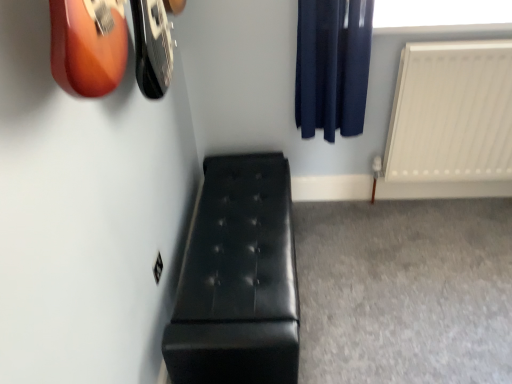
At what (x,y) coordinates should I click in order to perform the action: click on free space that is to the left of white matte radiator at right. Please return your answer as a coordinate pair (x, y). The height and width of the screenshot is (384, 512). Looking at the image, I should click on (366, 233).